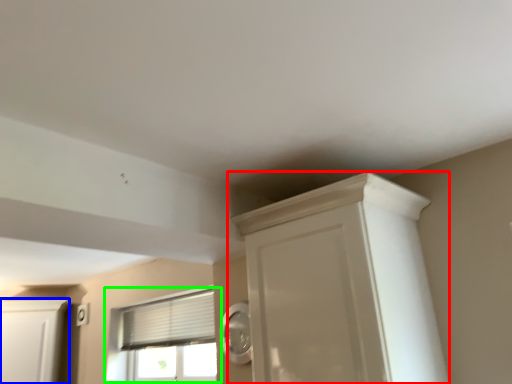
Question: Which object is positioned closest to cupboard (highlighted by a red box)? Select from cabinetry (highlighted by a blue box) and window (highlighted by a green box).

Choices:
 (A) cabinetry
 (B) window

Answer: (B)